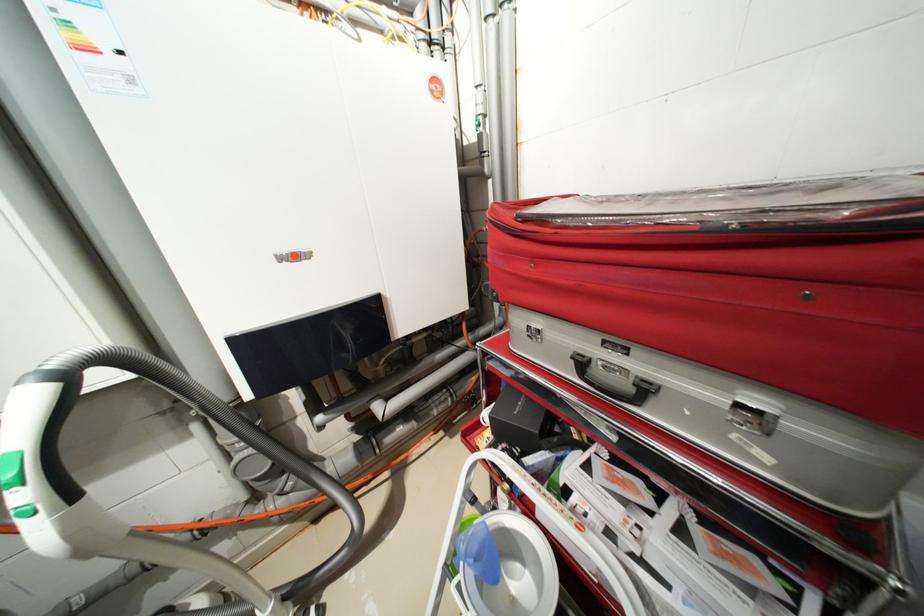
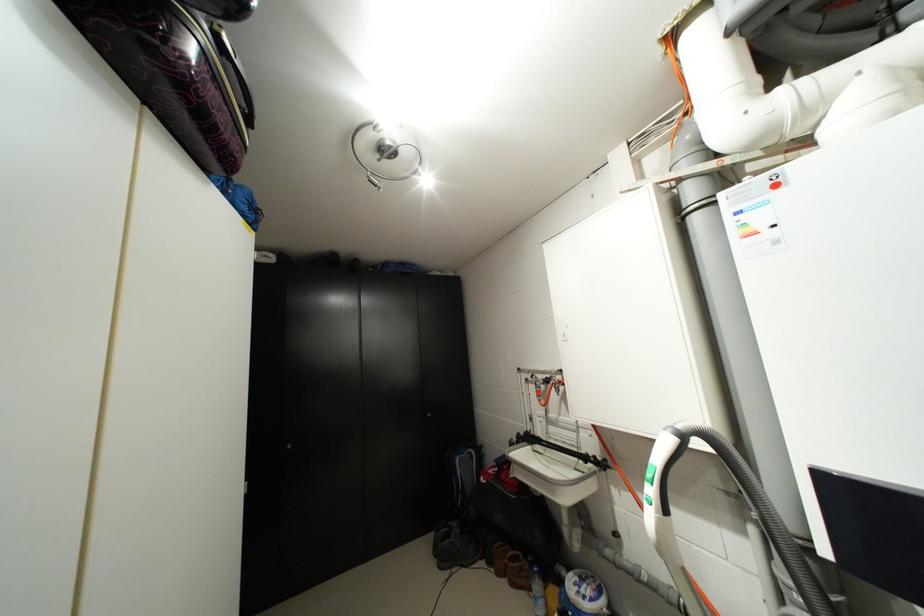
Question: The camera is either moving clockwise (left) or counter-clockwise (right) around the object. The first image is from the beginning of the video and the second image is from the end. Is the camera moving left or right when shooting the video?

Choices:
 (A) Left
 (B) Right

Answer: (B)